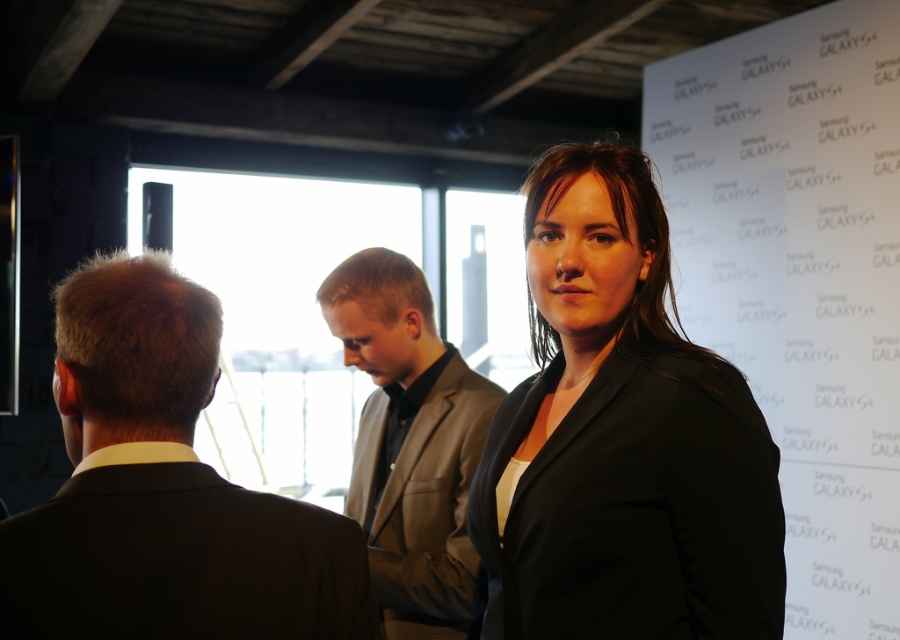
You are a photographer at the event and need to adjust the lighting for the person wearing the black suit at left. Based on their position, where should you place the light source to ensure even illumination?

The black suit at left is positioned at point (163, 490). To ensure even illumination, the light source should be placed opposite to this coordinate, likely around point (735, 148), to balance the lighting across the scene.

You are organizing a fashion show and need to arrange two suits on a runway. The black suit at left and the gray matte suit at center must be placed side by side. Which suit should be placed on the left side to ensure they are aligned properly?

The black suit at left should be placed on the left side because it has a lesser width compared to the gray matte suit at center, ensuring proper alignment when placed side by side.